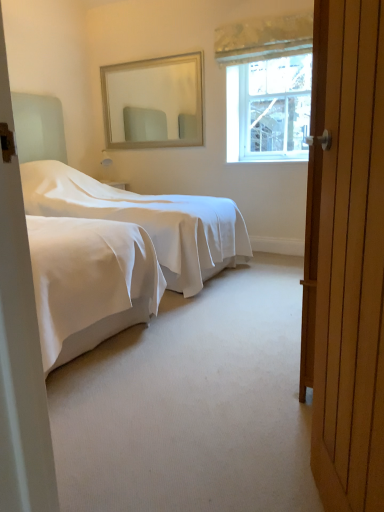
Question: Does white smooth bed at center contain beige framed mirror at upper center?

Choices:
 (A) no
 (B) yes

Answer: (A)

Question: From the image's perspective, does white smooth bed at center appear lower than beige framed mirror at upper center?

Choices:
 (A) yes
 (B) no

Answer: (A)

Question: Is white smooth bed at center bigger than beige framed mirror at upper center?

Choices:
 (A) yes
 (B) no

Answer: (A)

Question: Does white smooth bed at center have a lesser width compared to beige framed mirror at upper center?

Choices:
 (A) yes
 (B) no

Answer: (B)

Question: Is white smooth bed at center smaller than beige framed mirror at upper center?

Choices:
 (A) no
 (B) yes

Answer: (A)

Question: Would you consider white smooth bed at center to be distant from beige framed mirror at upper center?

Choices:
 (A) yes
 (B) no

Answer: (A)

Question: Are wooden door at right and white smooth bed at center far apart?

Choices:
 (A) no
 (B) yes

Answer: (B)

Question: Is wooden door at right positioned in front of white smooth bed at center?

Choices:
 (A) yes
 (B) no

Answer: (A)

Question: From the image's perspective, is wooden door at right under white smooth bed at center?

Choices:
 (A) no
 (B) yes

Answer: (B)

Question: Is wooden door at right in contact with white smooth bed at center?

Choices:
 (A) no
 (B) yes

Answer: (A)

Question: Can you confirm if wooden door at right is thinner than white smooth bed at center?

Choices:
 (A) no
 (B) yes

Answer: (B)

Question: Does wooden door at right contain white smooth bed at center?

Choices:
 (A) no
 (B) yes

Answer: (A)

Question: From the image's perspective, does wooden door at right appear higher than clear glass window at upper right?

Choices:
 (A) no
 (B) yes

Answer: (A)